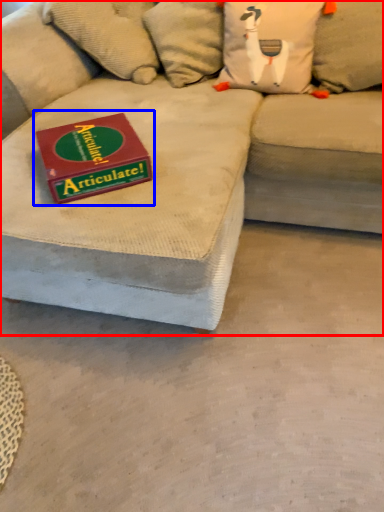
Question: Among these objects, which one is farthest to the camera, studio couch (highlighted by a red box) or paperback book (highlighted by a blue box)?

Choices:
 (A) studio couch
 (B) paperback book

Answer: (B)